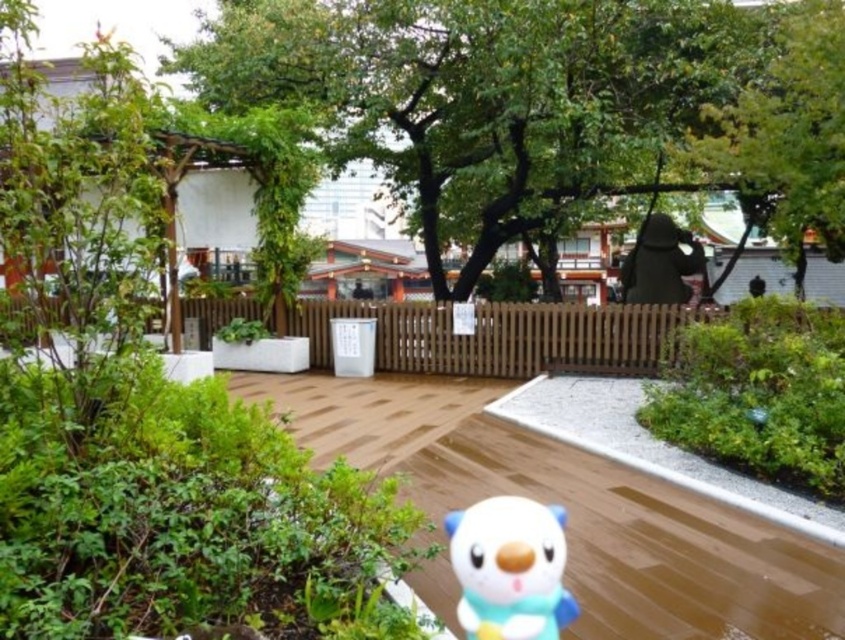
You are standing at the entrance of the garden and want to take a photo of the green leafy tree at center. Where should you position yourself to capture it in the center of your camera viewfinder?

To capture the green leafy tree at center in the center of your camera viewfinder, position yourself directly in front of the tree at its 2D location coordinates point (549, 104).

You are a photographer standing at the edge of the wooden deck in the garden scene. You want to capture a photo where both the green leafy tree at center and the white matte plush toy at lower center are visible. Which object will appear larger in the photo?

The green leafy tree at center will appear larger in the photo because it has a greater height compared to the white matte plush toy at lower center.

You are a visitor in this garden and want to take a photo of the green leafy tree at center and the white matte plush toy at lower center. Which object should you focus on first if you want to capture both in sharp focus?

The green leafy tree at center is further to the viewer than the white matte plush toy at lower center, so you should focus on the green leafy tree at center first to ensure both are in sharp focus.